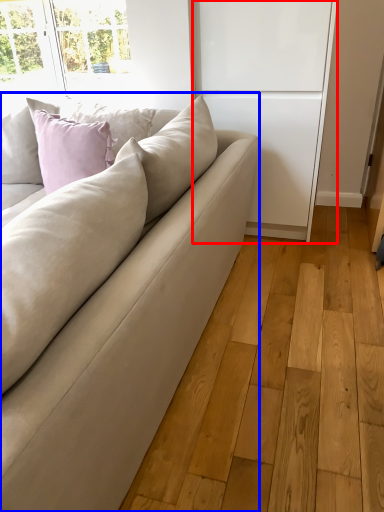
Question: Which object appears closest to the camera in this image, screen door (highlighted by a red box) or studio couch (highlighted by a blue box)?

Choices:
 (A) screen door
 (B) studio couch

Answer: (B)